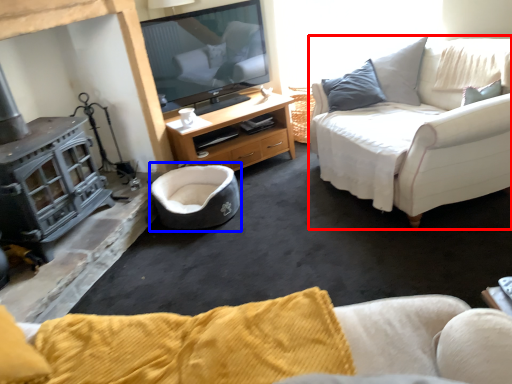
Question: Which object is further to the camera taking this photo, studio couch (highlighted by a red box) or bean bag chair (highlighted by a blue box)?

Choices:
 (A) studio couch
 (B) bean bag chair

Answer: (B)